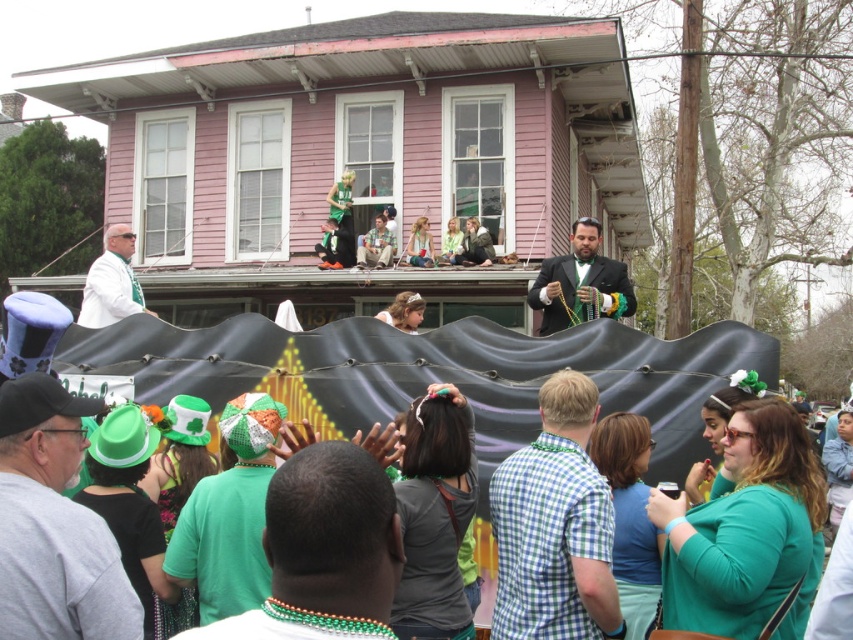
Question: Which object is positioned farthest from the green felt hat at center?

Choices:
 (A) teal matte shirt at lower right
 (B) green checkered shirt at center
 (C) green matte shirt at lower center

Answer: (C)

Question: Observing the image, what is the correct spatial positioning of green checkered shirt at center in reference to teal matte shirt at lower right?

Choices:
 (A) above
 (B) below

Answer: (A)

Question: Is shiny black suit at center wider than green felt hat at center?

Choices:
 (A) yes
 (B) no

Answer: (A)

Question: Among these points, which one is farthest from the camera?

Choices:
 (A) (68, 595)
 (B) (252, 541)

Answer: (B)

Question: Can you confirm if green matte shirt at lower center is smaller than dark gray fabric at center?

Choices:
 (A) yes
 (B) no

Answer: (B)

Question: Which point is farther to the camera?

Choices:
 (A) green felt hat at lower left
 (B) matte green hat at center
 (C) green jersey at center
 (D) green felt hat at center

Answer: (B)